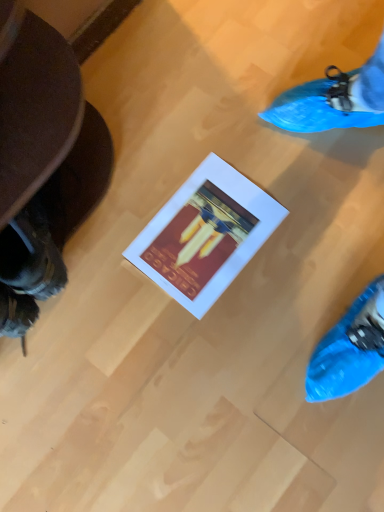
Where is `vacant region above white matte picture frame at center (from a real-world perspective)`? The height and width of the screenshot is (512, 384). vacant region above white matte picture frame at center (from a real-world perspective) is located at coordinates (203, 233).